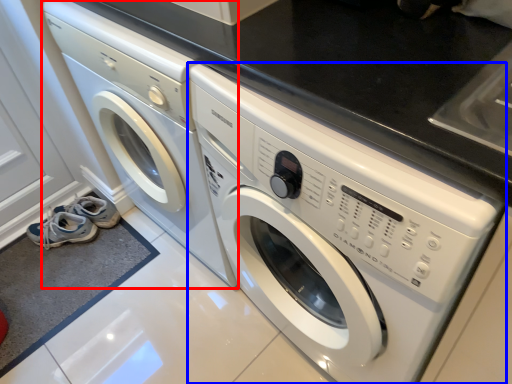
Question: Among these objects, which one is nearest to the camera, washing machine (highlighted by a red box) or washing machine (highlighted by a blue box)?

Choices:
 (A) washing machine
 (B) washing machine

Answer: (B)